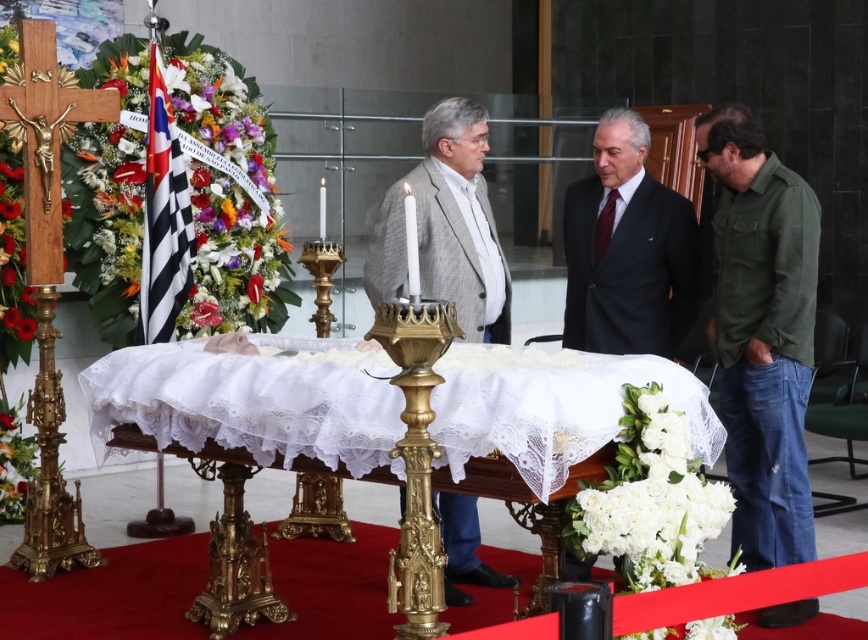
Question: Based on their relative distances, which object is nearer to the green denim jacket at lower right?

Choices:
 (A) gray wool jacket at center
 (B) black suit at center
 (C) white lace cloth at center

Answer: (B)

Question: Which object is farther from the camera taking this photo?

Choices:
 (A) green denim jacket at lower right
 (B) white lace cloth at center

Answer: (A)

Question: Which of these objects is positioned farthest from the green denim jacket at lower right?

Choices:
 (A) gray wool jacket at center
 (B) black suit at center

Answer: (A)

Question: Can you confirm if white lace cloth at center is thinner than green denim jacket at lower right?

Choices:
 (A) yes
 (B) no

Answer: (B)

Question: Is white lace cloth at center further to the viewer compared to green denim jacket at lower right?

Choices:
 (A) no
 (B) yes

Answer: (A)

Question: Is white lace cloth at center positioned behind green denim jacket at lower right?

Choices:
 (A) no
 (B) yes

Answer: (A)